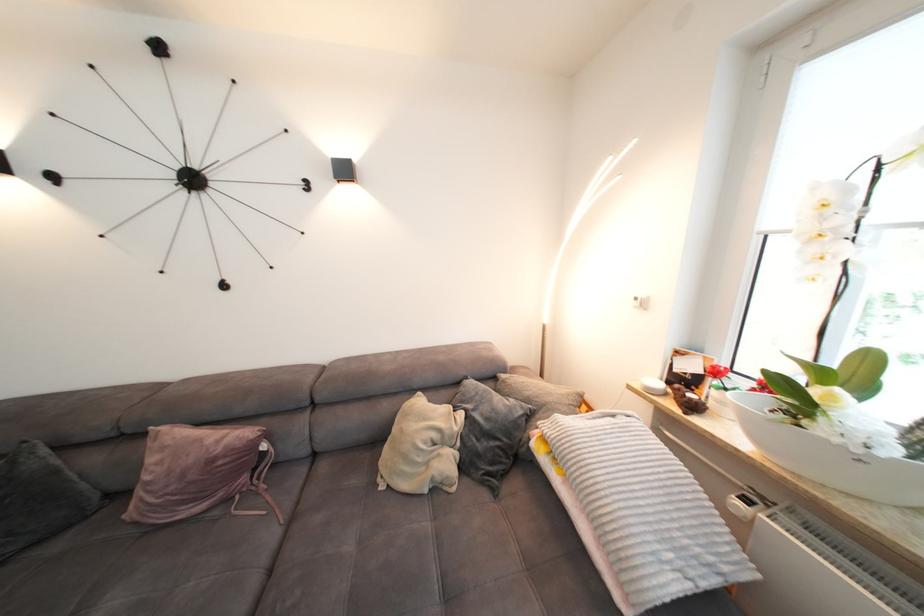
The location [40,496] corresponds to which object?

It corresponds to the grey pillow in the image.